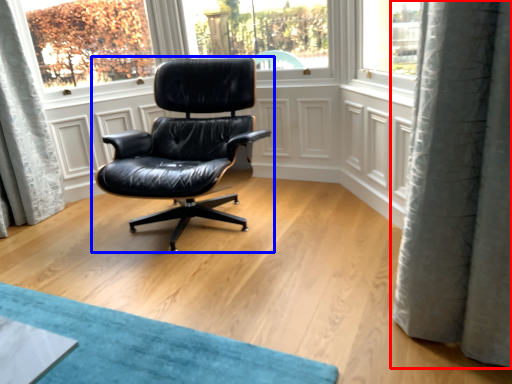
Question: Which of the following is the closest to the observer, curtain (highlighted by a red box) or chair (highlighted by a blue box)?

Choices:
 (A) curtain
 (B) chair

Answer: (A)